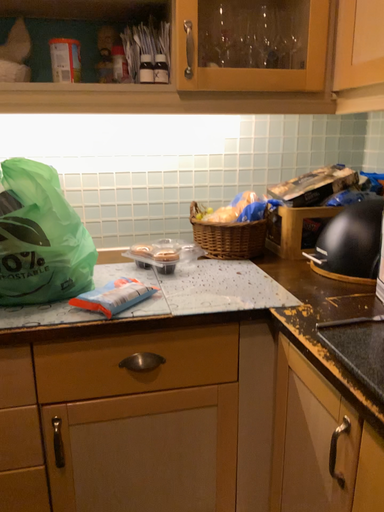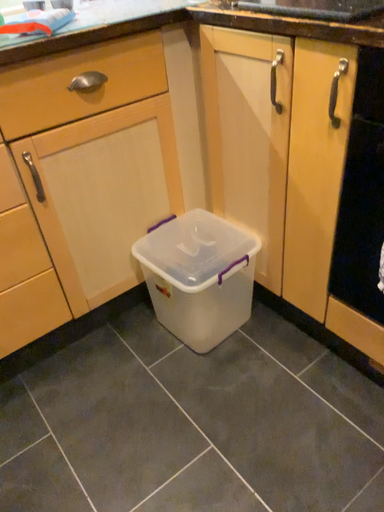
Question: Which way did the camera rotate in the video?

Choices:
 (A) rotated downward
 (B) rotated upward

Answer: (A)